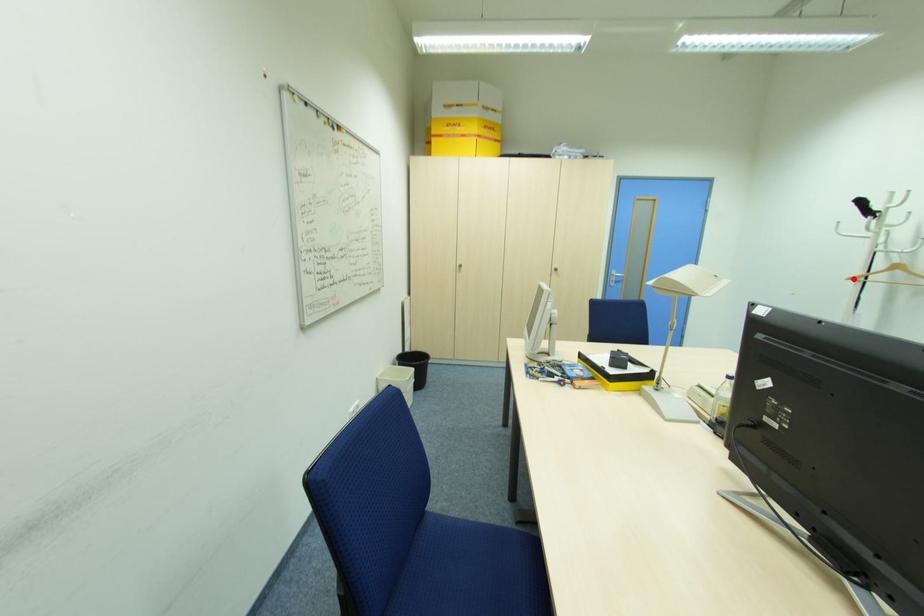
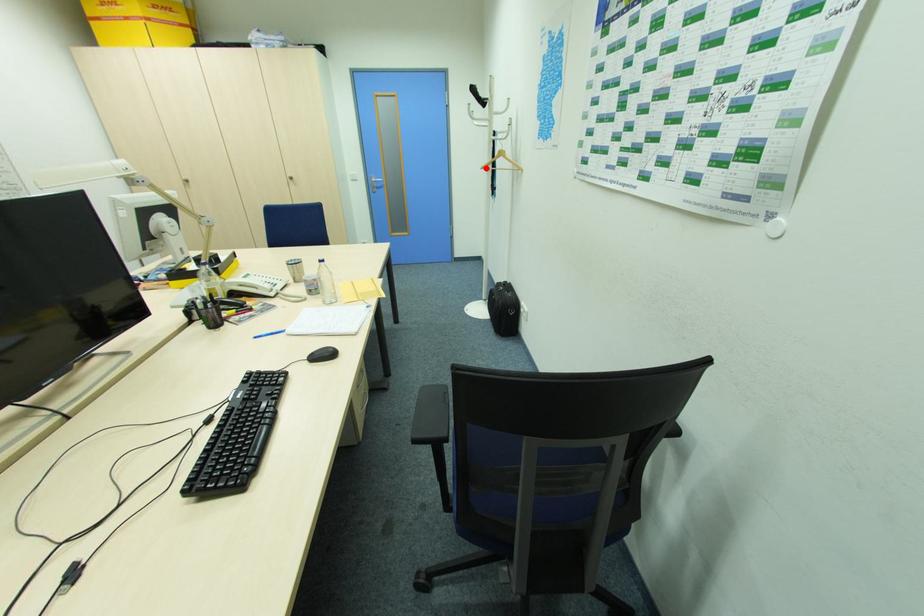
I am providing you with two images of the same scene from different viewpoints. A red point is marked on the first image and another point is marked on the second image. Is the marked point in image1 the same physical position as the marked point in image2?

Yes